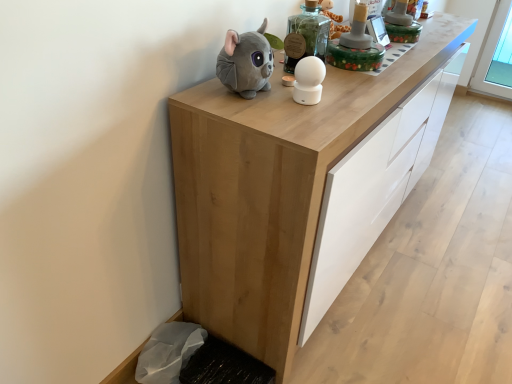
Find the location of a particular element. empty space that is to the right of white matte ball at center, which is the 2th toy in left-to-right order is located at coordinates (356, 97).